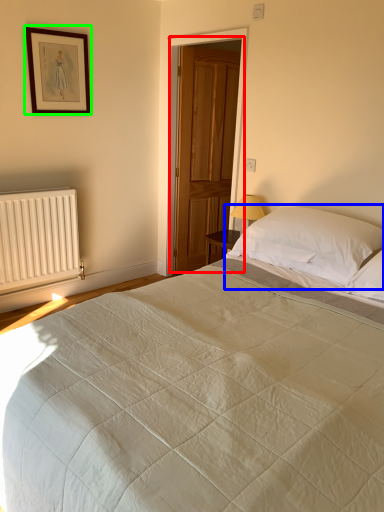
Question: Which is nearer to the door (highlighted by a red box)? pillow (highlighted by a blue box) or picture frame (highlighted by a green box).

Choices:
 (A) pillow
 (B) picture frame

Answer: (B)